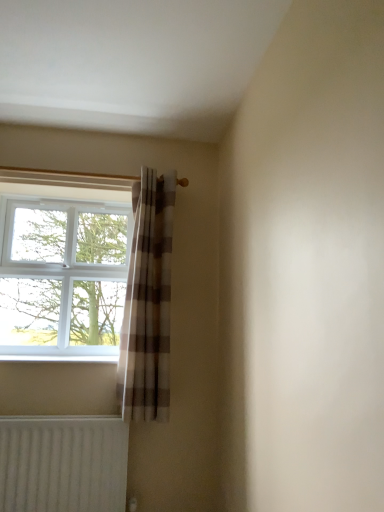
Describe the element at coordinates (148, 303) in the screenshot. The image size is (384, 512). I see `plaid fabric curtain at center` at that location.

What do you see at coordinates (63, 265) in the screenshot? I see `white plastic window at left` at bounding box center [63, 265].

Where is `white ribbed radiator at lower left`? The image size is (384, 512). white ribbed radiator at lower left is located at coordinates (63, 464).

Is plaid fabric curtain at center at the left side of white plastic window at left?

Incorrect, plaid fabric curtain at center is not on the left side of white plastic window at left.

Which is in front, point (133, 402) or point (99, 261)?

Positioned in front is point (133, 402).

From the image's perspective, which one is positioned higher, plaid fabric curtain at center or white plastic window at left?

white plastic window at left is shown above in the image.

Considering the positions of objects white ribbed radiator at lower left and plaid fabric curtain at center in the image provided, who is more to the left, white ribbed radiator at lower left or plaid fabric curtain at center?

white ribbed radiator at lower left is more to the left.

Is white ribbed radiator at lower left directly adjacent to plaid fabric curtain at center?

There is a gap between white ribbed radiator at lower left and plaid fabric curtain at center.

Which object is wider, white ribbed radiator at lower left or plaid fabric curtain at center?

plaid fabric curtain at center.

From a real-world perspective, who is located higher, white ribbed radiator at lower left or plaid fabric curtain at center?

plaid fabric curtain at center.

Is white plastic window at left bigger than plaid fabric curtain at center?

Correct, white plastic window at left is larger in size than plaid fabric curtain at center.

Is white plastic window at left placed right next to plaid fabric curtain at center?

white plastic window at left and plaid fabric curtain at center are not in contact.

Considering the positions of objects white plastic window at left and plaid fabric curtain at center in the image provided, who is more to the left, white plastic window at left or plaid fabric curtain at center?

white plastic window at left is more to the left.

Which object is more forward, white plastic window at left or plaid fabric curtain at center?

plaid fabric curtain at center is in front.

Considering the relative sizes of white ribbed radiator at lower left and white plastic window at left in the image provided, is white ribbed radiator at lower left wider than white plastic window at left?

No.

In terms of height, does white ribbed radiator at lower left look taller or shorter compared to white plastic window at left?

Considering their sizes, white ribbed radiator at lower left has less height than white plastic window at left.

From the picture: From the image's perspective, does white ribbed radiator at lower left appear higher than white plastic window at left?

No, from the image's perspective, white ribbed radiator at lower left is not over white plastic window at left.

Is white ribbed radiator at lower left at the left side of white plastic window at left?

In fact, white ribbed radiator at lower left is to the right of white plastic window at left.

Can you tell me how much white plastic window at left and white ribbed radiator at lower left differ in facing direction?

white plastic window at left and white ribbed radiator at lower left are facing 0.00504 degrees away from each other.

From a real-world perspective, which is physically above, white plastic window at left or white ribbed radiator at lower left?

white plastic window at left, from a real-world perspective.

Is white plastic window at left not inside white ribbed radiator at lower left?

Absolutely, white plastic window at left is external to white ribbed radiator at lower left.

This screenshot has height=512, width=384. I want to click on window behind the white ribbed radiator at lower left, so click(63, 265).

Where is `curtain that appears above the white ribbed radiator at lower left (from the image's perspective)`? The height and width of the screenshot is (512, 384). curtain that appears above the white ribbed radiator at lower left (from the image's perspective) is located at coordinates (148, 303).

Between plaid fabric curtain at center and white ribbed radiator at lower left, which one has more height?

plaid fabric curtain at center.

Is plaid fabric curtain at center directly adjacent to white ribbed radiator at lower left?

No, plaid fabric curtain at center is not making contact with white ribbed radiator at lower left.

The width and height of the screenshot is (384, 512). Find the location of `window above the plaid fabric curtain at center (from the image's perspective)`. window above the plaid fabric curtain at center (from the image's perspective) is located at coordinates (63, 265).

Where is `radiator on the left of plaid fabric curtain at center`? The image size is (384, 512). radiator on the left of plaid fabric curtain at center is located at coordinates (63, 464).

In the scene shown: Looking at the image, which one is located further to white ribbed radiator at lower left, white plastic window at left or plaid fabric curtain at center?

white plastic window at left is further to white ribbed radiator at lower left.

From the image, which object appears to be nearer to white plastic window at left, white ribbed radiator at lower left or plaid fabric curtain at center?

plaid fabric curtain at center is positioned closer to the anchor white plastic window at left.

From the image, which object appears to be nearer to plaid fabric curtain at center, white plastic window at left or white ribbed radiator at lower left?

white ribbed radiator at lower left is closer to plaid fabric curtain at center.

Based on their spatial positions, is plaid fabric curtain at center or white ribbed radiator at lower left closer to white plastic window at left?

Based on the image, plaid fabric curtain at center appears to be nearer to white plastic window at left.

From the image, which object appears to be nearer to white ribbed radiator at lower left, plaid fabric curtain at center or white plastic window at left?

plaid fabric curtain at center.

When comparing their distances from plaid fabric curtain at center, does white ribbed radiator at lower left or white plastic window at left seem closer?

white ribbed radiator at lower left is positioned closer to the anchor plaid fabric curtain at center.

Identify the location of curtain between white plastic window at left and white ribbed radiator at lower left vertically. The width and height of the screenshot is (384, 512). (148, 303).